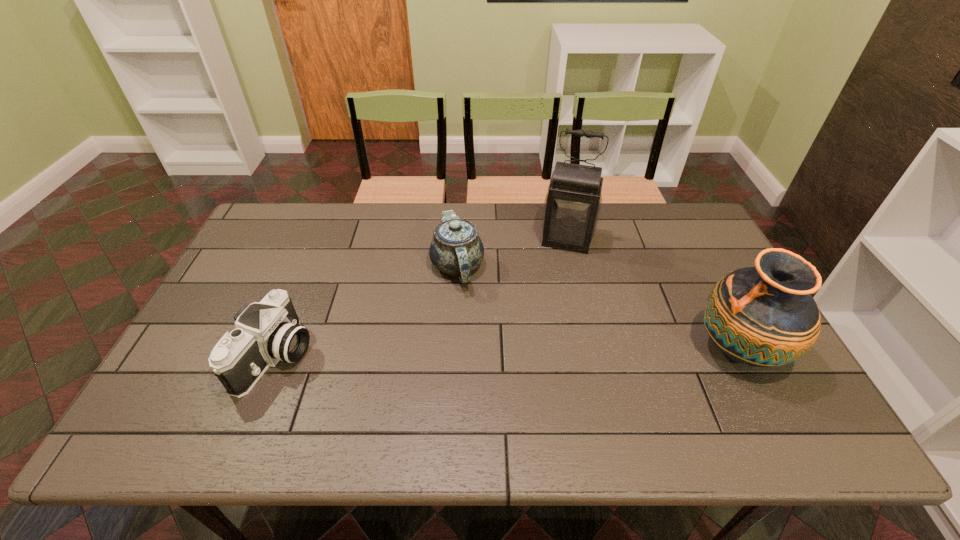
Where is `object that is at the near left corner`? object that is at the near left corner is located at coordinates (266, 332).

Locate an element on the screen. This screenshot has width=960, height=540. object that is at the near right corner is located at coordinates (763, 316).

Find the location of a particular element. This screenshot has width=960, height=540. free space at the far edge is located at coordinates (480, 209).

In the image, there is a desktop. Where is `vacant space at the near edge`? This screenshot has width=960, height=540. vacant space at the near edge is located at coordinates (529, 403).

I want to click on vacant area at the left edge, so click(240, 306).

Find the location of a particular element. free space at the far left corner of the desktop is located at coordinates (292, 229).

Image resolution: width=960 pixels, height=540 pixels. Find the location of `vacant area between the third object from left to right and the third shortest object`. vacant area between the third object from left to right and the third shortest object is located at coordinates (x=653, y=295).

I want to click on free space that is in between the camera and the second tallest object, so click(x=507, y=353).

At what (x,y) coordinates should I click in order to perform the action: click on empty space between the second object from left to right and the camera. Please return your answer as a coordinate pair (x, y). Looking at the image, I should click on (367, 311).

Find the location of a particular element. This screenshot has width=960, height=540. free spot between the camera and the tallest object is located at coordinates (422, 298).